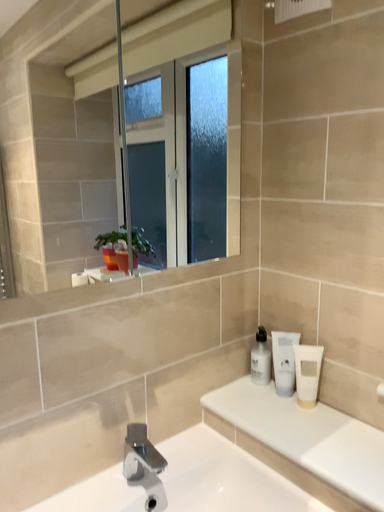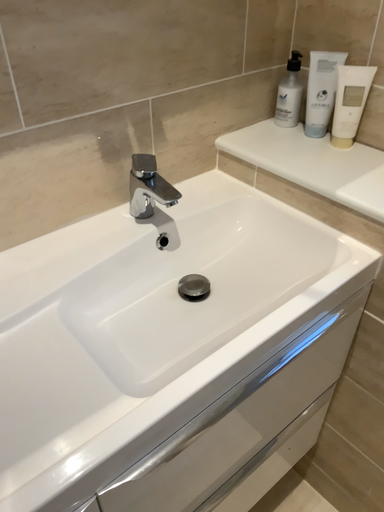
Question: How did the camera likely rotate when shooting the video?

Choices:
 (A) rotated upward
 (B) rotated downward

Answer: (B)